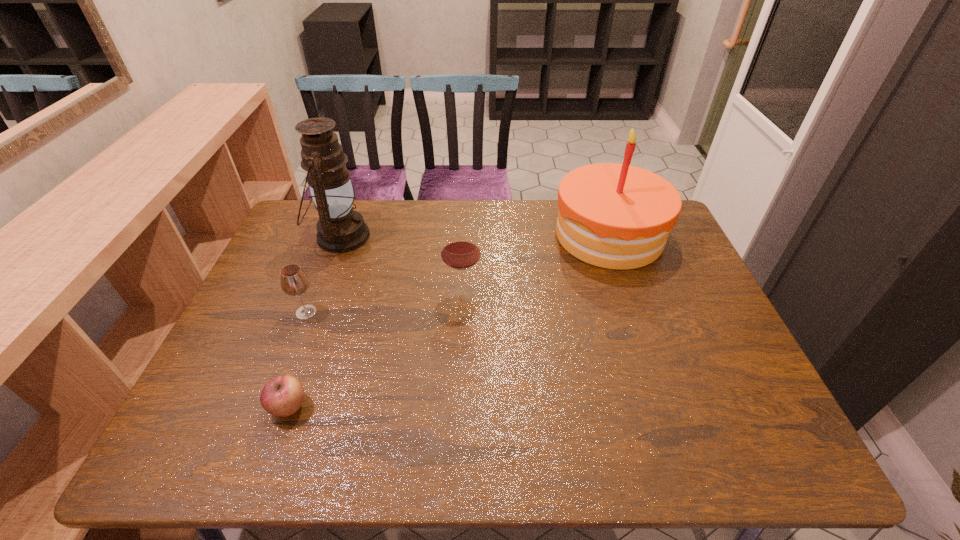
Identify the location of free space between the birthday cake and the nearest object. (449, 321).

Locate an element on the screen. free space between the shorter wineglass and the rightmost object is located at coordinates (458, 274).

Image resolution: width=960 pixels, height=540 pixels. Find the location of `blank region between the third tallest object and the oil lamp`. blank region between the third tallest object and the oil lamp is located at coordinates pos(401,265).

The height and width of the screenshot is (540, 960). In order to click on unoccupied area between the left wineglass and the apple in this screenshot , I will do `click(298, 360)`.

This screenshot has height=540, width=960. In order to click on unoccupied position between the left wineglass and the nearest object in this screenshot , I will do `click(298, 360)`.

Locate an element on the screen. the closest object to the left wineglass is located at coordinates (340, 229).

Locate an element on the screen. The image size is (960, 540). object that stands as the fourth closest to the shortest object is located at coordinates (616, 216).

This screenshot has width=960, height=540. I want to click on blank space that satisfies the following two spatial constraints: 1. on the front side of the apple; 2. on the left side of the left wineglass, so click(x=270, y=407).

This screenshot has width=960, height=540. I want to click on free spot that satisfies the following two spatial constraints: 1. on the back side of the rightmost object; 2. on the left side of the left wineglass, so click(x=336, y=235).

Where is `free region that satisfies the following two spatial constraints: 1. on the front side of the oil lamp; 2. on the right side of the shortest object`? The width and height of the screenshot is (960, 540). free region that satisfies the following two spatial constraints: 1. on the front side of the oil lamp; 2. on the right side of the shortest object is located at coordinates (276, 407).